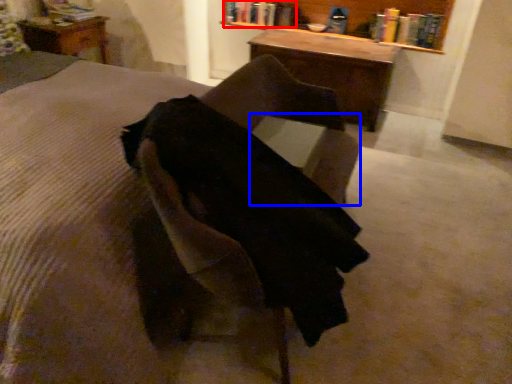
Question: Among these objects, which one is nearest to the camera, book (highlighted by a red box) or table (highlighted by a blue box)?

Choices:
 (A) book
 (B) table

Answer: (B)